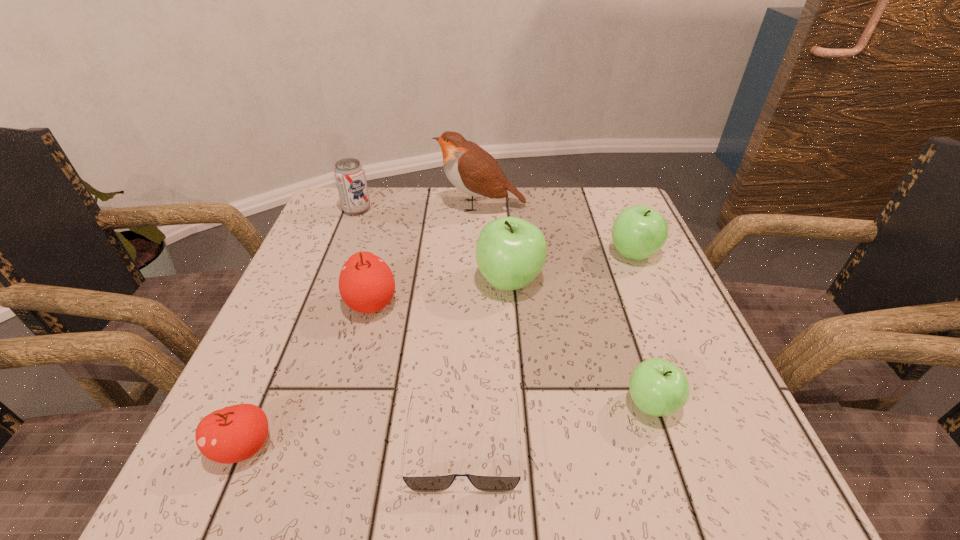
I want to click on blank space at the far edge, so click(551, 228).

In the image, there is a desktop. At what (x,y) coordinates should I click in order to perform the action: click on vacant area at the near edge. Please return your answer as a coordinate pair (x, y). The width and height of the screenshot is (960, 540). Looking at the image, I should click on (583, 442).

In the image, there is a desktop. Identify the location of vacant space at the left edge. click(294, 339).

Where is `free point at the right edge`? The height and width of the screenshot is (540, 960). free point at the right edge is located at coordinates (712, 413).

Identify the location of vacant region at the far left corner of the desktop. Image resolution: width=960 pixels, height=540 pixels. (338, 200).

You are a GUI agent. You are given a task and a screenshot of the screen. Output one action in this format:
    pyautogui.click(x=<x>, y=<y>)
    Task: Click on the vacant area at the near left corner
    
    Given the screenshot: What is the action you would take?
    pyautogui.click(x=317, y=439)

Where is `free space at the far right corner of the desktop`? The image size is (960, 540). free space at the far right corner of the desktop is located at coordinates 600,219.

The image size is (960, 540). I want to click on free point between the second smallest green apple and the leftmost apple, so click(x=439, y=350).

At what (x,y) coordinates should I click in order to perform the action: click on free space between the farther red apple and the smallest green apple. Please return your answer as a coordinate pair (x, y). This screenshot has height=540, width=960. Looking at the image, I should click on (512, 354).

Identify the location of vacant space that is in between the biggest green apple and the farther red apple. (x=441, y=292).